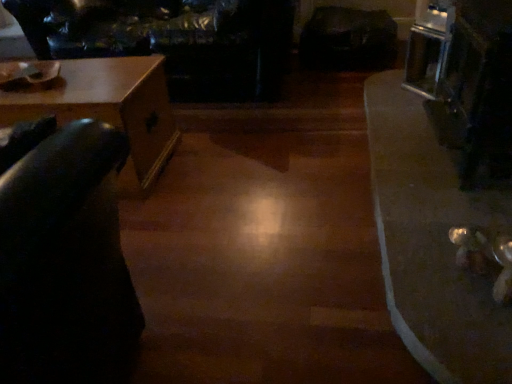
I want to click on vacant area that lies to the right of wooden table at left, the first table from the left, so click(225, 163).